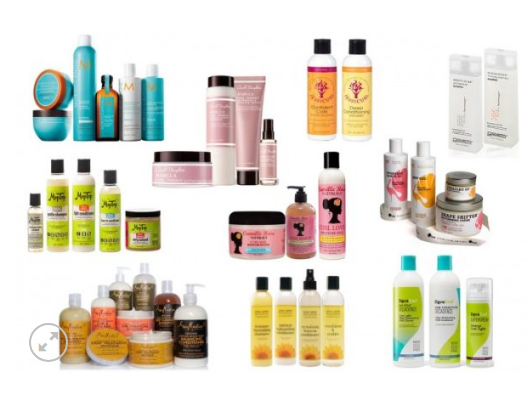
Image resolution: width=528 pixels, height=401 pixels. What are the coordinates of `pump bottles` in the screenshot? It's located at (188, 292), (118, 278), (310, 281), (304, 195), (268, 133).